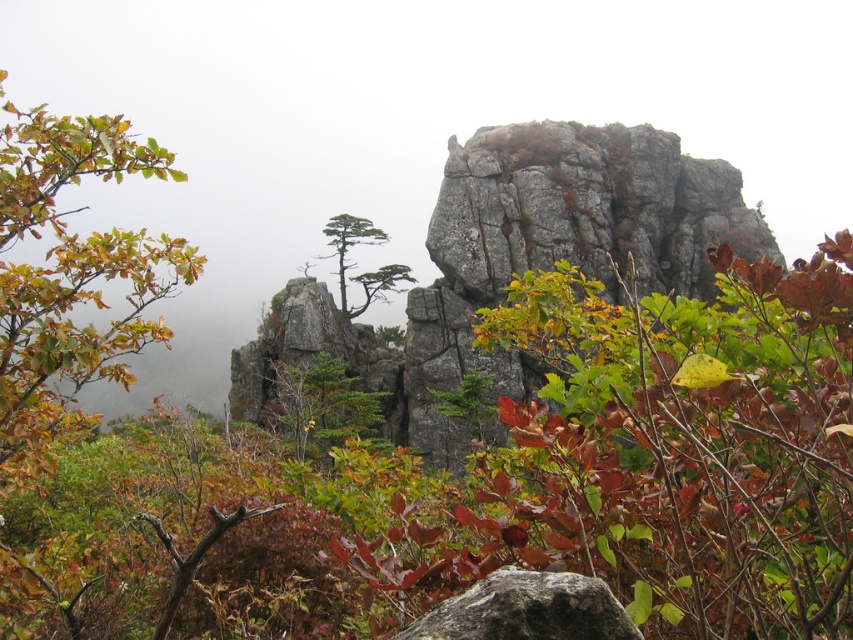
In the scene shown: Can you confirm if green leafy shrub at center is wider than green matte tree at center?

Yes.

Does green leafy shrub at center appear on the left side of green matte tree at center?

Incorrect, green leafy shrub at center is not on the left side of green matte tree at center.

Between point (759, 508) and point (338, 253), which one is positioned behind?

Positioned behind is point (338, 253).

Locate an element on the screen. This screenshot has width=853, height=640. green leafy shrub at center is located at coordinates (491, 481).

Between gray rough boulder at center and green matte tree at center, which one is positioned higher?

green matte tree at center

Can you confirm if gray rough boulder at center is positioned above green matte tree at center?

Actually, gray rough boulder at center is below green matte tree at center.

Where is `gray rough boulder at center`? The height and width of the screenshot is (640, 853). gray rough boulder at center is located at coordinates (526, 609).

Locate an element on the screen. This screenshot has height=640, width=853. gray rough boulder at center is located at coordinates (526, 609).

Who is taller, green leafy shrub at center or gray rough boulder at center?

With more height is green leafy shrub at center.

Who is more distant from viewer, (221, 516) or (503, 621)?

The point (221, 516) is behind.

Who is more distant from viewer, (697, 332) or (486, 582)?

Positioned behind is point (697, 332).

At what (x,y) coordinates should I click in order to perform the action: click on green leafy shrub at center. Please return your answer as a coordinate pair (x, y). This screenshot has width=853, height=640. Looking at the image, I should click on (491, 481).